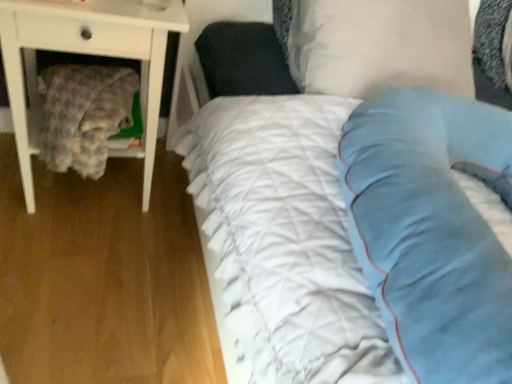
In order to click on free space below white wood nightstand at left (from a real-world perspective) in this screenshot , I will do `click(95, 187)`.